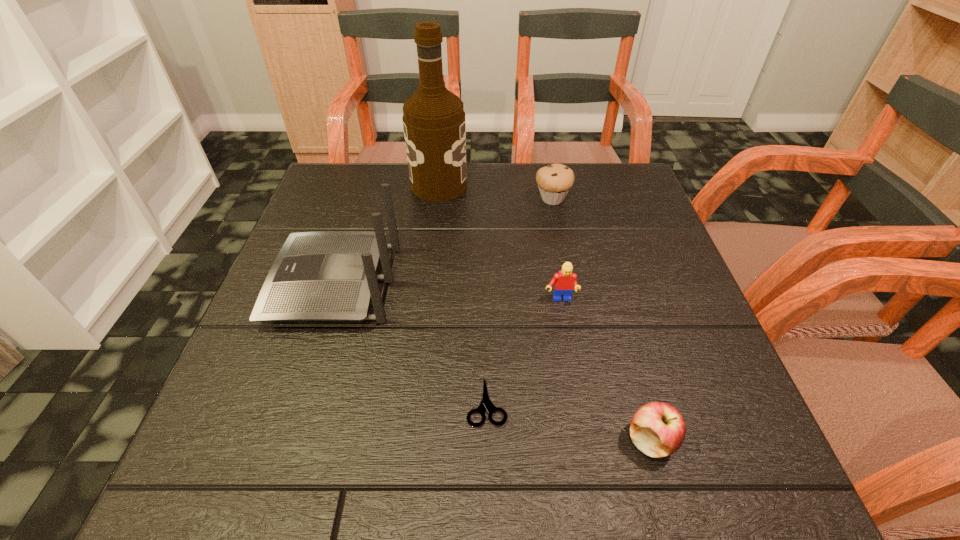
Where is `the tallest object`? the tallest object is located at coordinates (433, 118).

Find the location of a particular element. The image size is (960, 540). router is located at coordinates (329, 275).

Find the location of a particular element. Lego is located at coordinates (564, 281).

The height and width of the screenshot is (540, 960). I want to click on muffin, so click(x=554, y=181).

The height and width of the screenshot is (540, 960). I want to click on apple, so click(x=657, y=429).

Locate an element on the screen. This screenshot has width=960, height=540. the shortest object is located at coordinates (486, 403).

I want to click on the fourth object from right to left, so click(x=486, y=403).

The width and height of the screenshot is (960, 540). Find the location of `free space located 0.070m on the label of the tallest object`. free space located 0.070m on the label of the tallest object is located at coordinates (492, 186).

Find the location of a particular element. The width and height of the screenshot is (960, 540). free spot located 0.220m on the front-facing side of the Lego is located at coordinates (578, 406).

Identify the location of vacant space situated on the front of the muffin. (564, 252).